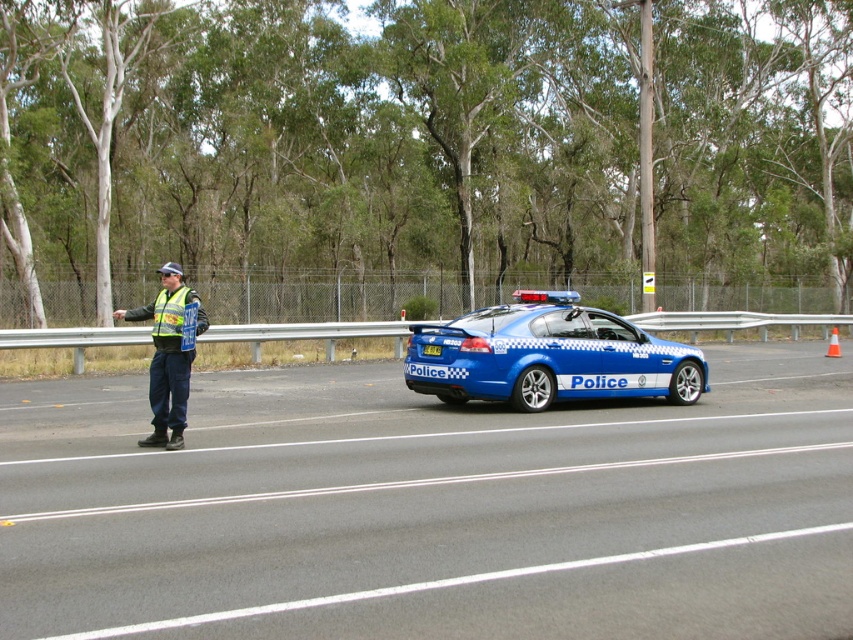
You are a pedestrian standing at the point labeled as point (x=549, y=355). You want to cross the road to reach the police officer on the left side. Is the blue metallic police car at center blocking your path?

The point (x=549, y=355) corresponds to the blue metallic police car at center, so you are currently standing at the location of the blue metallic police car at center. Therefore, the blue metallic police car at center is blocking your path to the police officer on the left side.

You are a pedestrian standing on the left side of the road where the police officer is located. You want to cross the road to the right side. There are two points marked on the road ahead of you. The first point is at coordinate point(581,344), and the second point is at coordinate point(749,323). Which point should you aim for first to cross safely?

You should aim for point(581,344) first because it is in front of point(749,323), meaning it is closer to your starting position on the left side of the road.